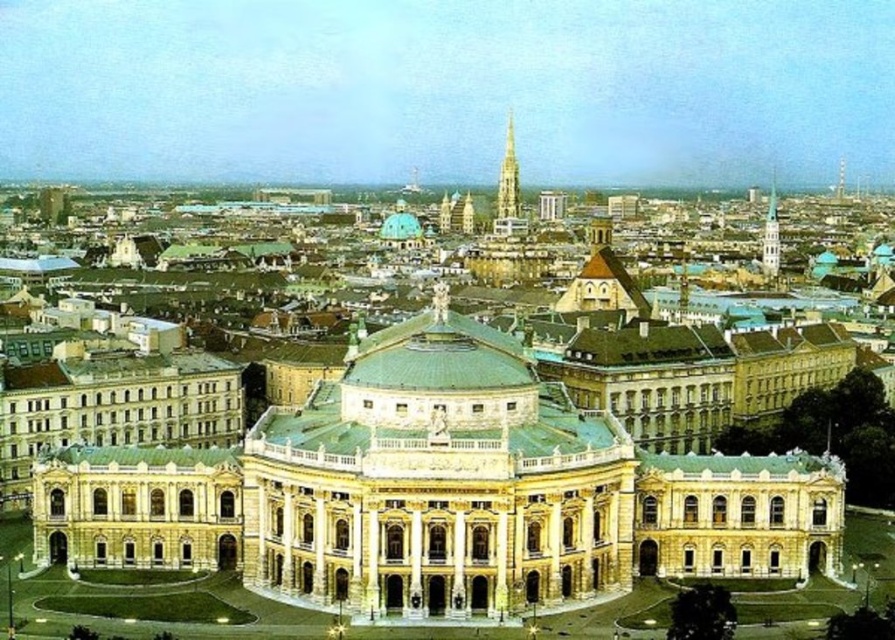
Question: Where is golden spire at center located in relation to gold textured spire at upper right in the image?

Choices:
 (A) below
 (B) above

Answer: (B)

Question: Does beige stone palace at center appear over golden spire at center?

Choices:
 (A) yes
 (B) no

Answer: (B)

Question: Does golden spire at center have a smaller size compared to gold textured spire at upper right?

Choices:
 (A) yes
 (B) no

Answer: (A)

Question: Which point appears closest to the camera in this image?

Choices:
 (A) (764, 273)
 (B) (499, 168)

Answer: (A)

Question: Which point appears farthest from the camera in this image?

Choices:
 (A) (570, 417)
 (B) (774, 248)

Answer: (B)

Question: Which point is farther from the camera taking this photo?

Choices:
 (A) (513, 163)
 (B) (501, 419)
 (C) (774, 218)

Answer: (A)